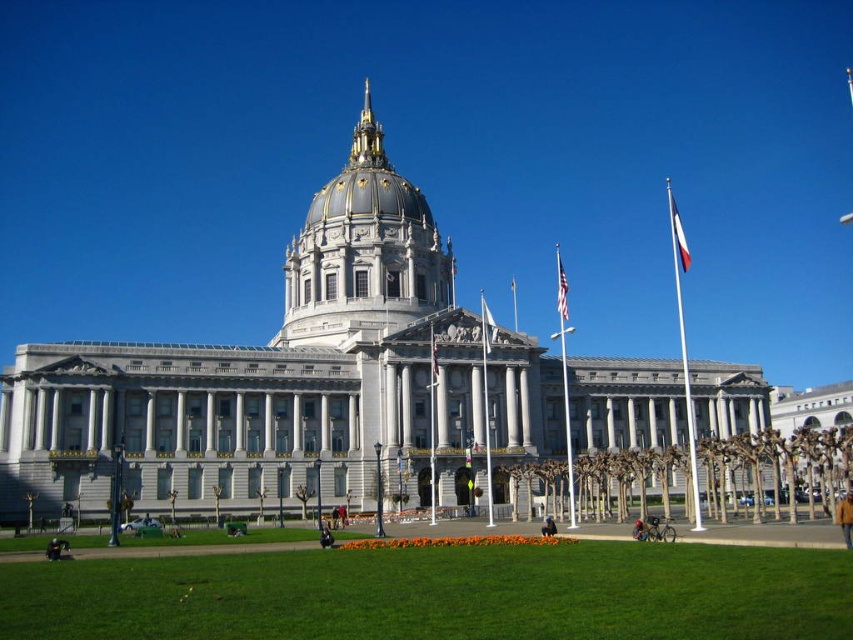
You are standing at the entrance of the grand neoclassical building and want to walk towards the dark blue jeans at lower center. The path leads across the green grass at lower center. If you start walking from the entrance, which object will you encounter first?

You will encounter the green grass at lower center first because it is closer to you than the dark blue jeans at lower center, as the distance between them is 15.98 meters.

You are standing in front of the grand neoclassical building and see the green grass at lower center and the dark blue jeans at lower center. Which object is closer to you?

The green grass at lower center is closer to you because it is in front of the dark blue jeans at lower center.

You are a visitor standing in front of the grand neoclassical building. You see the brown leather jacket at lower right and the american flag at center. Which object is closer to the ground?

The brown leather jacket at lower right is below the american flag at center, so it is closer to the ground.